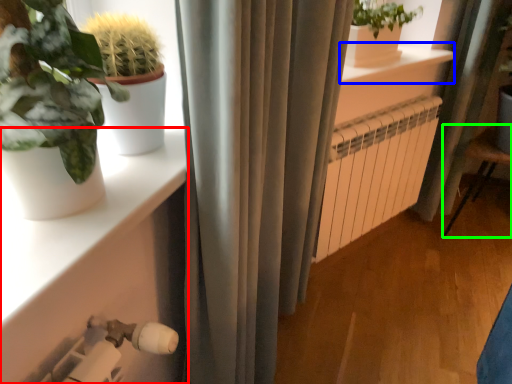
Question: Which is nearer to the shelf (highlighted by a red box)? window sill (highlighted by a blue box) or armchair (highlighted by a green box).

Choices:
 (A) window sill
 (B) armchair

Answer: (A)